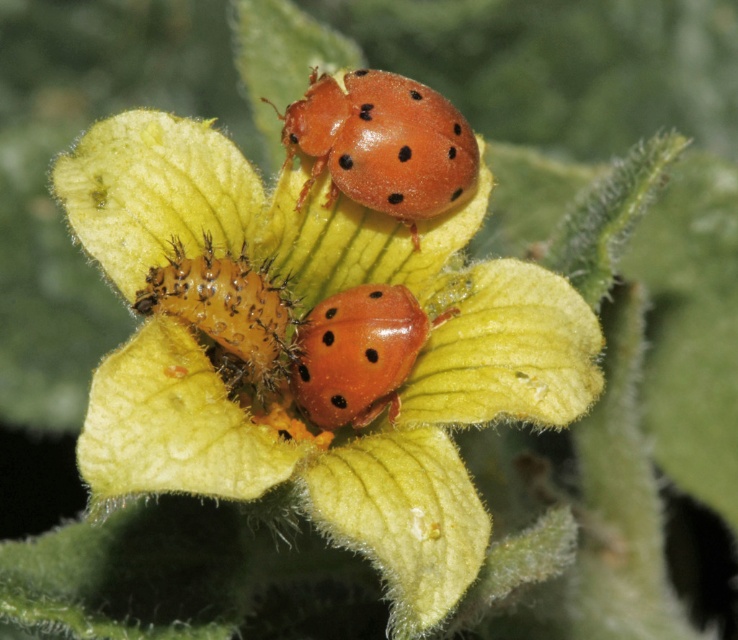
You are a gardener trying to identify the largest object between the smooth yellow flower at center and the matte orange beetle at upper center. Which one is bigger?

The smooth yellow flower at center is larger than the matte orange beetle at upper center according to the description.

You are a gardener who wants to place a small decorative stone between the smooth yellow flower at center and the fuzzy orange caterpillar at center. Since both are at the center, which one should you place the stone closer to in order to keep it balanced?

The smooth yellow flower at center is taller than the fuzzy orange caterpillar at center, so placing the stone closer to the caterpillar would help balance the composition, as the flower is taller and might visually weigh more.

You are a photographer taking a closeup photo of a flower with two ladybugs. You want to focus on the ladybug closer to the camera. Which ladybug should you focus on, the one at point (292, 154) or the one at point (165, 284)?

You should focus on the ladybug at point (292, 154) because it is further to the camera than point (165, 284).